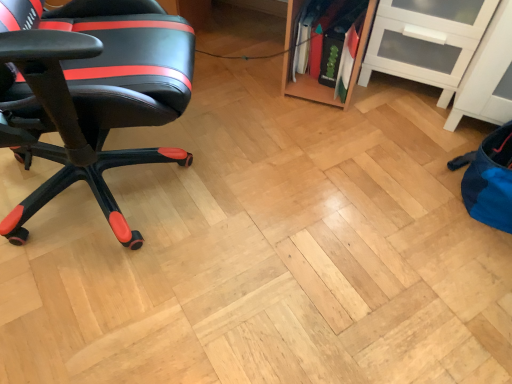
Describe the element at coordinates (92, 93) in the screenshot. The image size is (512, 384). I see `black leather chair at left` at that location.

Locate an element on the screen. The width and height of the screenshot is (512, 384). black leather chair at left is located at coordinates (92, 93).

Measure the distance between point (105,161) and camera.

The distance of point (105,161) from camera is 1.47 meters.

Measure the distance between point (508, 9) and camera.

Point (508, 9) is 1.38 meters from camera.

You are a GUI agent. You are given a task and a screenshot of the screen. Output one action in this format:
    pyautogui.click(x=<x>, y=<y>)
    Task: Click on the white glossy cabinet at upper right
    The width and height of the screenshot is (512, 384).
    Given the screenshot: What is the action you would take?
    pyautogui.click(x=447, y=53)

The width and height of the screenshot is (512, 384). Describe the element at coordinates (447, 53) in the screenshot. I see `white glossy cabinet at upper right` at that location.

I want to click on black leather chair at left, so click(x=92, y=93).

Between black leather chair at left and white glossy cabinet at upper right, which one appears on the right side from the viewer's perspective?

white glossy cabinet at upper right is more to the right.

Between black leather chair at left and white glossy cabinet at upper right, which one is positioned in front?

black leather chair at left is more forward.

Which point is more distant from viewer, (179, 153) or (511, 58)?

The point (179, 153) is more distant.

From the image's perspective, is black leather chair at left under white glossy cabinet at upper right?

Yes, from the image's perspective, black leather chair at left is beneath white glossy cabinet at upper right.

From a real-world perspective, which is physically above, black leather chair at left or white glossy cabinet at upper right?

In real-world perspective, black leather chair at left is above.

Looking at their sizes, would you say black leather chair at left is wider or thinner than white glossy cabinet at upper right?

black leather chair at left is wider than white glossy cabinet at upper right.

Which of these two, black leather chair at left or white glossy cabinet at upper right, stands taller?

black leather chair at left is taller.

Considering the sizes of objects black leather chair at left and white glossy cabinet at upper right in the image provided, who is bigger, black leather chair at left or white glossy cabinet at upper right?

black leather chair at left is bigger.

Looking at this image, would you say white glossy cabinet at upper right is part of black leather chair at left's contents?

No, white glossy cabinet at upper right is not a part of black leather chair at left.

Is black leather chair at left next to white glossy cabinet at upper right?

No, black leather chair at left is not next to white glossy cabinet at upper right.

Is black leather chair at left facing away from white glossy cabinet at upper right?

No, white glossy cabinet at upper right is not at the back of black leather chair at left.

How many degrees apart are the facing directions of black leather chair at left and white glossy cabinet at upper right?

black leather chair at left and white glossy cabinet at upper right are facing 116 degrees away from each other.

You are a GUI agent. You are given a task and a screenshot of the screen. Output one action in this format:
    pyautogui.click(x=<x>, y=<y>)
    Task: Click on the chair located above the white glossy cabinet at upper right (from a real-world perspective)
    This screenshot has height=384, width=512.
    Given the screenshot: What is the action you would take?
    pyautogui.click(x=92, y=93)

Considering the relative positions of white glossy cabinet at upper right and black leather chair at left in the image provided, is white glossy cabinet at upper right to the right of black leather chair at left from the viewer's perspective?

Correct, you'll find white glossy cabinet at upper right to the right of black leather chair at left.

Between white glossy cabinet at upper right and black leather chair at left, which one is positioned in front?

black leather chair at left is closer to the camera.

Is point (422, 70) positioned behind point (76, 170)?

Yes, it is behind point (76, 170).

From the image's perspective, is white glossy cabinet at upper right located beneath black leather chair at left?

No, from the image's perspective, white glossy cabinet at upper right is not below black leather chair at left.

From a real-world perspective, who is located higher, white glossy cabinet at upper right or black leather chair at left?

black leather chair at left, from a real-world perspective.

Which object is wider, white glossy cabinet at upper right or black leather chair at left?

With larger width is black leather chair at left.

Who is taller, white glossy cabinet at upper right or black leather chair at left?

black leather chair at left.

Which of these two, white glossy cabinet at upper right or black leather chair at left, is bigger?

black leather chair at left.

Is white glossy cabinet at upper right outside of black leather chair at left?

That's correct, white glossy cabinet at upper right is outside of black leather chair at left.

Does white glossy cabinet at upper right touch black leather chair at left?

No.

Could you tell me if white glossy cabinet at upper right is facing black leather chair at left?

No, white glossy cabinet at upper right is not aimed at black leather chair at left.

What's the angular difference between white glossy cabinet at upper right and black leather chair at left's facing directions?

There is a 116-degree angle between the facing directions of white glossy cabinet at upper right and black leather chair at left.

Identify the location of shelf below the black leather chair at left (from a real-world perspective). The width and height of the screenshot is (512, 384). (447, 53).

At what (x,y) coordinates should I click in order to perform the action: click on chair on the left side of white glossy cabinet at upper right. Please return your answer as a coordinate pair (x, y). Image resolution: width=512 pixels, height=384 pixels. Looking at the image, I should click on (92, 93).

This screenshot has width=512, height=384. In the image, there is a black leather chair at left. Find the location of `shelf below it (from a real-world perspective)`. shelf below it (from a real-world perspective) is located at coordinates (447, 53).